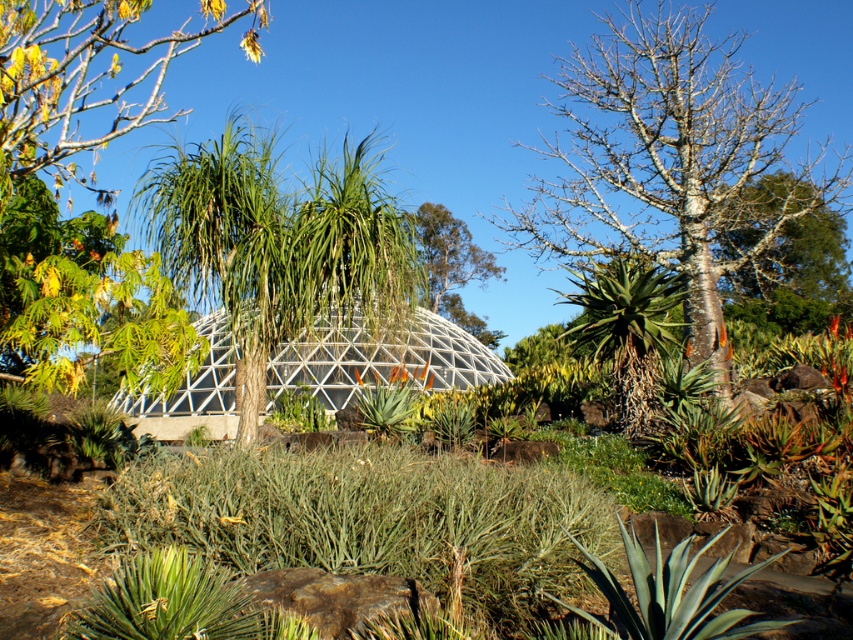
Which of these two, transparent glass dome at center or smooth bark tree at upper right, stands taller?

With more height is smooth bark tree at upper right.

Does transparent glass dome at center appear on the right side of smooth bark tree at upper right?

In fact, transparent glass dome at center is to the left of smooth bark tree at upper right.

I want to click on transparent glass dome at center, so click(379, 358).

Locate an element on the screen. The height and width of the screenshot is (640, 853). transparent glass dome at center is located at coordinates (379, 358).

Between green leafy tree at center and transparent glass dome at center, which one appears on the right side from the viewer's perspective?

transparent glass dome at center is more to the right.

Who is more forward, (283,268) or (173,394)?

Point (283,268)

This screenshot has width=853, height=640. I want to click on green leafy tree at center, so click(x=276, y=243).

From the picture: Which is more to the right, green leafy tree at left or green leafy tree at center?

green leafy tree at center is more to the right.

What are the coordinates of `green leafy tree at left` in the screenshot? It's located at (86, 188).

Does point (0, 234) come in front of point (256, 362)?

Yes.

Locate an element on the screen. Image resolution: width=853 pixels, height=640 pixels. green leafy tree at left is located at coordinates (86, 188).